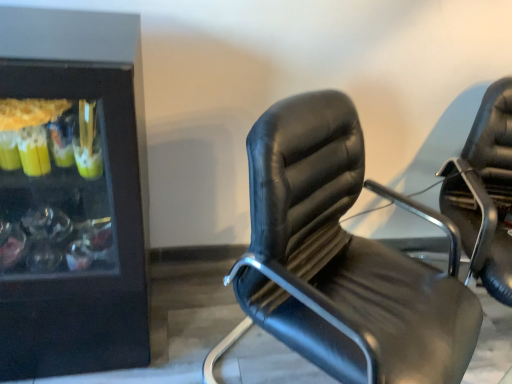
Image resolution: width=512 pixels, height=384 pixels. I want to click on black leather chair at center, so click(342, 259).

This screenshot has height=384, width=512. Describe the element at coordinates (342, 259) in the screenshot. I see `black leather chair at center` at that location.

Locate an element on the screen. black leather chair at center is located at coordinates (342, 259).